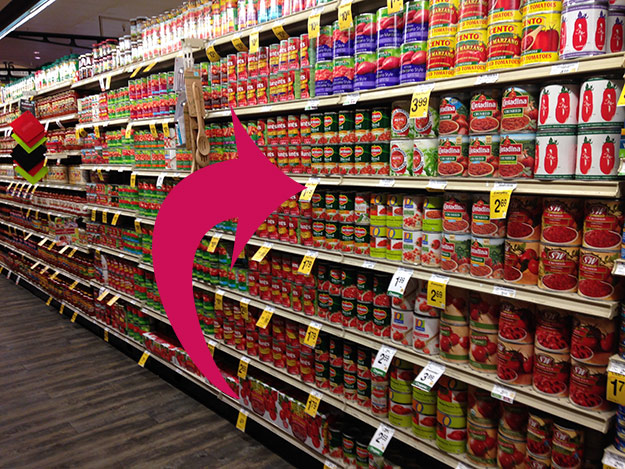
I want to click on glass jars holding red sauce second shelf from top half way down aisle, so click(x=70, y=100), click(x=64, y=100), click(x=59, y=100), click(x=48, y=103), click(x=42, y=103), click(x=37, y=106).